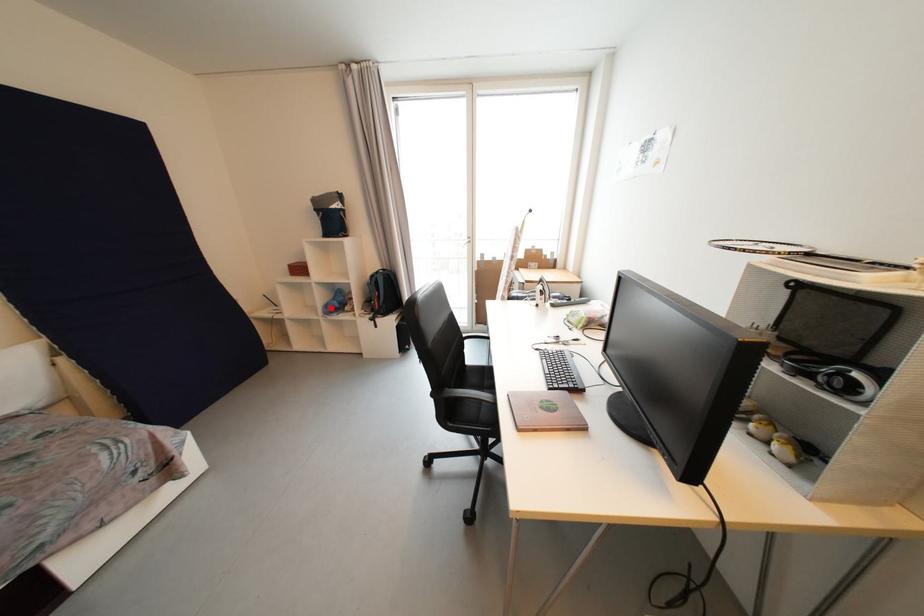
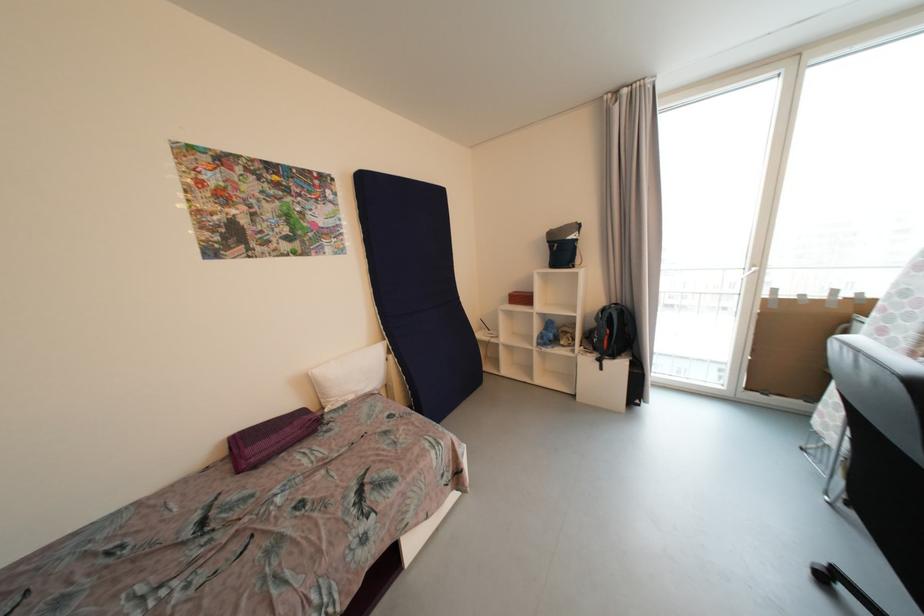
Where in the second image is the point corresponding to the highlighted location from the first image?

(545, 339)